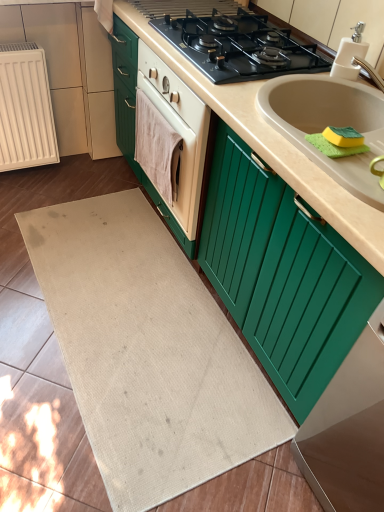
Question: Is beige matte countertop at center to the left of white ribbed radiator at left from the viewer's perspective?

Choices:
 (A) yes
 (B) no

Answer: (B)

Question: Does beige matte countertop at center have a greater width compared to white ribbed radiator at left?

Choices:
 (A) yes
 (B) no

Answer: (A)

Question: Can you confirm if beige matte countertop at center is thinner than white ribbed radiator at left?

Choices:
 (A) no
 (B) yes

Answer: (A)

Question: From the image's perspective, does beige matte countertop at center appear higher than white ribbed radiator at left?

Choices:
 (A) yes
 (B) no

Answer: (B)

Question: Does beige matte countertop at center have a larger size compared to white ribbed radiator at left?

Choices:
 (A) yes
 (B) no

Answer: (A)

Question: Is beige matte countertop at center taller or shorter than beige fabric bath mat at center?

Choices:
 (A) tall
 (B) short

Answer: (A)

Question: From a real-world perspective, is beige matte countertop at center positioned above or below beige fabric bath mat at center?

Choices:
 (A) below
 (B) above

Answer: (B)

Question: Is beige matte countertop at center spatially inside beige fabric bath mat at center, or outside of it?

Choices:
 (A) inside
 (B) outside

Answer: (B)

Question: Considering their positions, is beige matte countertop at center located in front of or behind beige fabric bath mat at center?

Choices:
 (A) behind
 (B) front

Answer: (B)

Question: Is green matte cabinet at lower right to the left or to the right of yellow-green sponge at sink right in the image?

Choices:
 (A) right
 (B) left

Answer: (A)

Question: From the image's perspective, relative to yellow-green sponge at sink right, is green matte cabinet at lower right above or below?

Choices:
 (A) below
 (B) above

Answer: (A)

Question: In terms of height, does green matte cabinet at lower right look taller or shorter compared to yellow-green sponge at sink right?

Choices:
 (A) tall
 (B) short

Answer: (A)

Question: Considering the positions of green matte cabinet at lower right and yellow-green sponge at sink right in the image, is green matte cabinet at lower right wider or thinner than yellow-green sponge at sink right?

Choices:
 (A) wide
 (B) thin

Answer: (A)

Question: Is beige fabric bath mat at center situated inside beige matte countertop at center or outside?

Choices:
 (A) outside
 (B) inside

Answer: (A)

Question: Considering the positions of beige fabric bath mat at center and beige matte countertop at center in the image, is beige fabric bath mat at center bigger or smaller than beige matte countertop at center?

Choices:
 (A) small
 (B) big

Answer: (A)